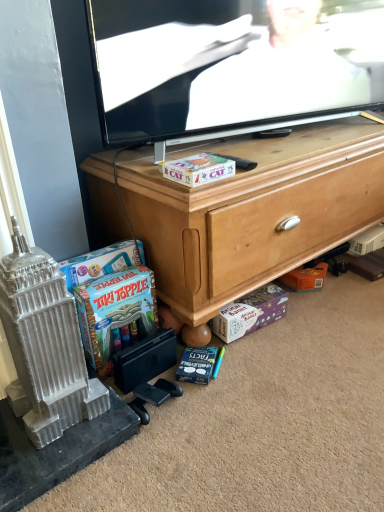
Question: From a real-world perspective, is black plastic remote control at center positioned above or below blue matte book at lower center?

Choices:
 (A) below
 (B) above

Answer: (B)

Question: Is black plastic remote control at center taller or shorter than blue matte book at lower center?

Choices:
 (A) short
 (B) tall

Answer: (A)

Question: Estimate the real-world distances between objects in this image. Which object is farther from the wooden cabinet at center?

Choices:
 (A) blue cardboard game at lower left, arranged as the second cash when viewed from the top
 (B) black plastic remote control at center
 (C) flat screen tv at upper center
 (D) blue matte book at lower center
 (E) matte cardboard box at center, which appears as the 2th cash when viewed from the right

Answer: (D)

Question: Which of these objects is positioned farthest from the blue matte book at lower center?

Choices:
 (A) black plastic remote control at center
 (B) blue cardboard game at lower left, which is the second cash in bottom-to-top order
 (C) matte cardboard box at center, which appears as the 2th cash when viewed from the right
 (D) wooden cabinet at center
 (E) flat screen tv at upper center

Answer: (E)